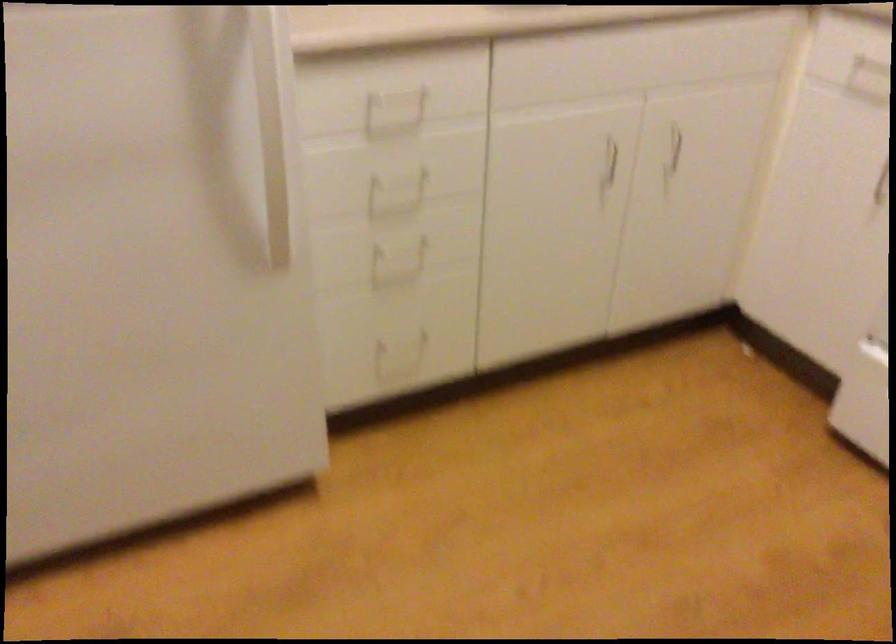
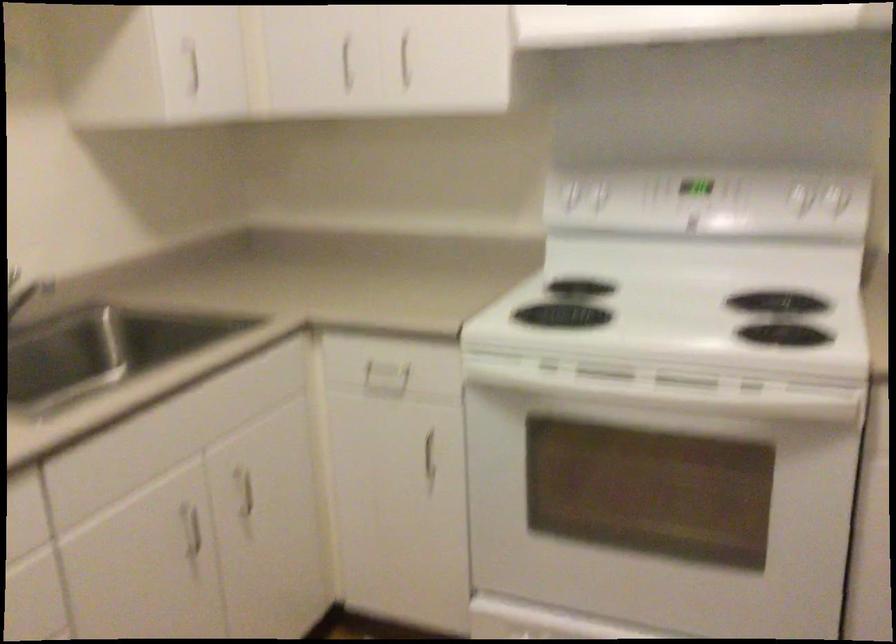
Question: The first image is from the beginning of the video and the second image is from the end. How did the camera likely rotate when shooting the video?

Choices:
 (A) Left
 (B) Right
 (C) Up
 (D) Down

Answer: (B)